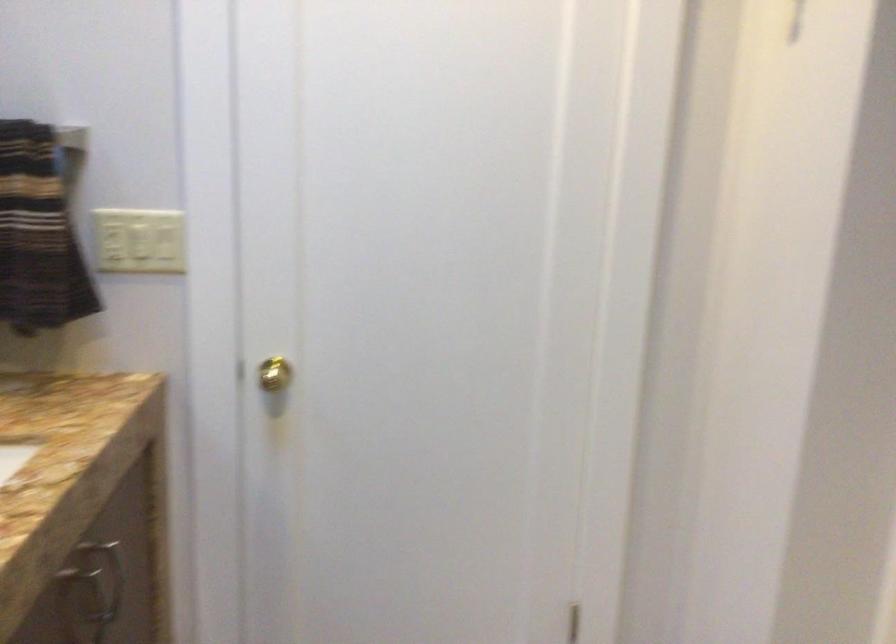
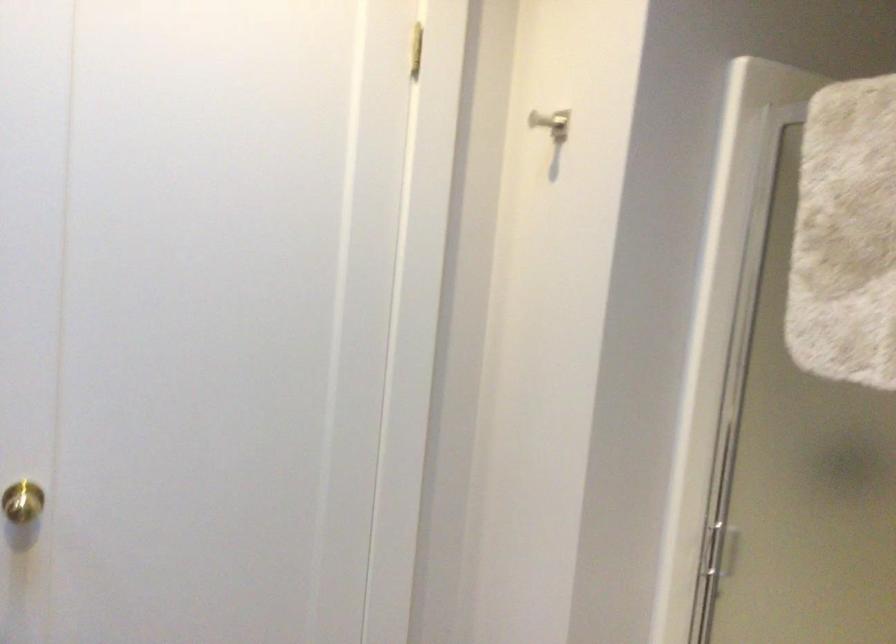
Question: Which direction would the cameraman need to move to produce the second image? Reply with the corresponding letter.

Choices:
 (A) Left
 (B) Right
 (C) Forward
 (D) Backward

Answer: (A)